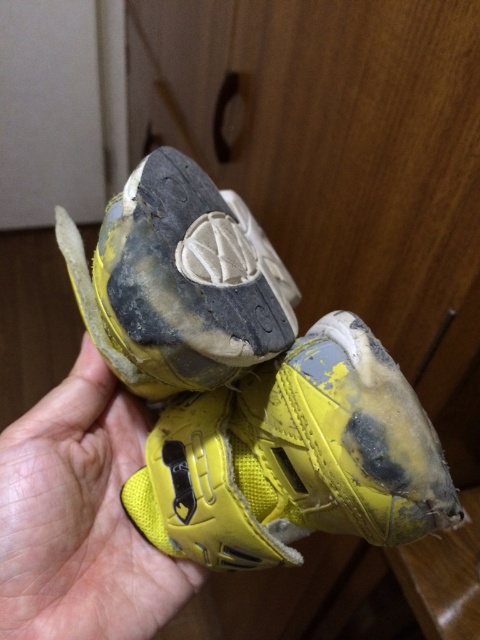
Which is in front, point (269, 442) or point (265, 259)?

Positioned in front is point (269, 442).

Image resolution: width=480 pixels, height=640 pixels. Describe the element at coordinates (295, 458) in the screenshot. I see `yellow fabric shoe at center` at that location.

Who is more distant from viewer, [347,525] or [226,323]?

Point [347,525]

The height and width of the screenshot is (640, 480). I want to click on yellow fabric shoe at center, so click(295, 458).

Does yellow fabric shoe at center lie in front of yellow fabric hand at center?

Yes, it is.

Who is more distant from viewer, (x=262, y=403) or (x=60, y=417)?

The point (x=60, y=417) is behind.

Find the location of a particular element. The image size is (480, 640). yellow fabric shoe at center is located at coordinates (295, 458).

Is yellow matte shoe at center taller than yellow fabric hand at center?

No, yellow matte shoe at center is not taller than yellow fabric hand at center.

This screenshot has width=480, height=640. What do you see at coordinates (179, 282) in the screenshot? I see `yellow matte shoe at center` at bounding box center [179, 282].

You are a GUI agent. You are given a task and a screenshot of the screen. Output one action in this format:
    pyautogui.click(x=<x>, y=<y>)
    Task: Click on the yellow matte shoe at center
    The width and height of the screenshot is (480, 640).
    Given the screenshot: What is the action you would take?
    click(179, 282)